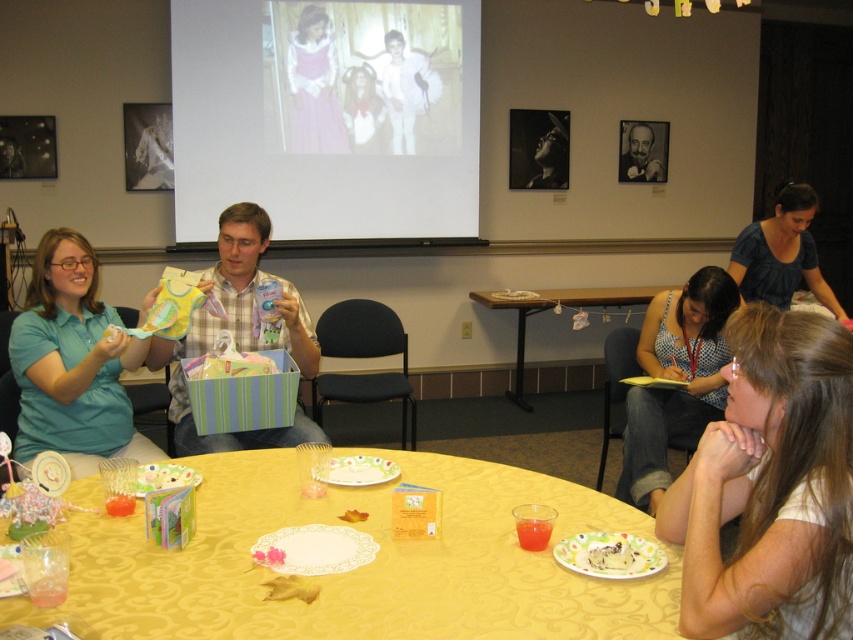
Question: Does white matte projection screen at upper center have a larger size compared to black matte portrait at upper right?

Choices:
 (A) yes
 (B) no

Answer: (A)

Question: Which object appears farthest from the camera in this image?

Choices:
 (A) white matte projection screen at upper center
 (B) matte teal shirt at left

Answer: (A)

Question: Which point appears farthest from the camera in this image?

Choices:
 (A) pyautogui.click(x=527, y=579)
 (B) pyautogui.click(x=244, y=237)
 (C) pyautogui.click(x=35, y=426)
 (D) pyautogui.click(x=834, y=364)

Answer: (B)

Question: Is white matte hair at lower right to the left of blue checkered shirt at lower right from the viewer's perspective?

Choices:
 (A) no
 (B) yes

Answer: (B)

Question: Estimate the real-world distances between objects in this image. Which object is farther from the matte plastic gift bag at upper left?

Choices:
 (A) yellow fabric table at center
 (B) white matte hair at lower right
 (C) wooden table at center
 (D) matte teal shirt at left

Answer: (C)

Question: Observing the image, what is the correct spatial positioning of matte teal shirt at left in reference to plaid shirt at center?

Choices:
 (A) left
 (B) right

Answer: (A)